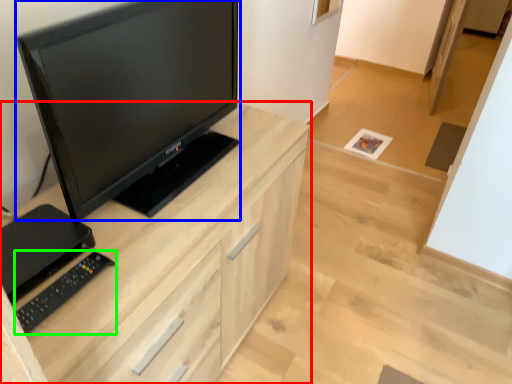
Question: Which object is the farthest from cabinetry (highlighted by a red box)? Choose among these: television (highlighted by a blue box) or equipment (highlighted by a green box).

Choices:
 (A) television
 (B) equipment

Answer: (B)